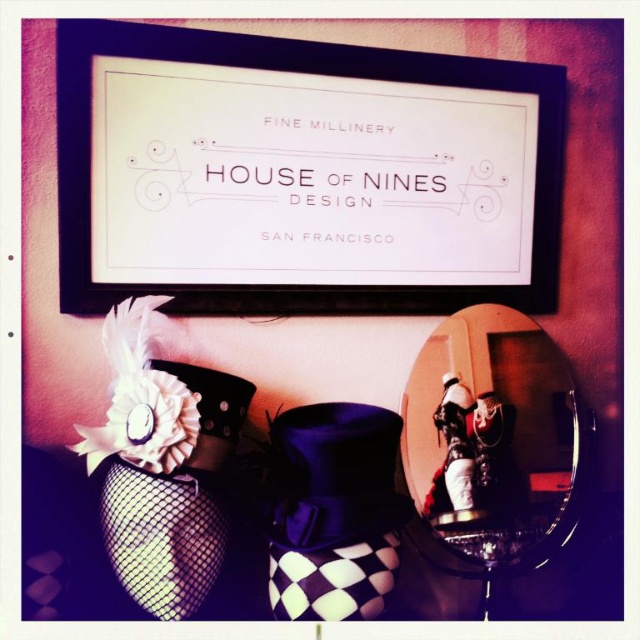
Question: Is black matte picture frame at upper center behind white fabric flower at lower left?

Choices:
 (A) no
 (B) yes

Answer: (B)

Question: Considering the relative positions of black matte picture frame at upper center and white fabric flower at lower left in the image provided, where is black matte picture frame at upper center located with respect to white fabric flower at lower left?

Choices:
 (A) above
 (B) below

Answer: (A)

Question: Among these objects, which one is nearest to the camera?

Choices:
 (A) white fabric flower at lower left
 (B) black matte picture frame at upper center

Answer: (A)

Question: Observing the image, what is the correct spatial positioning of black matte picture frame at upper center in reference to white fabric flower at lower left?

Choices:
 (A) left
 (B) right

Answer: (B)

Question: Which object is closer to the camera taking this photo?

Choices:
 (A) white fabric flower at lower left
 (B) black matte picture frame at upper center

Answer: (A)